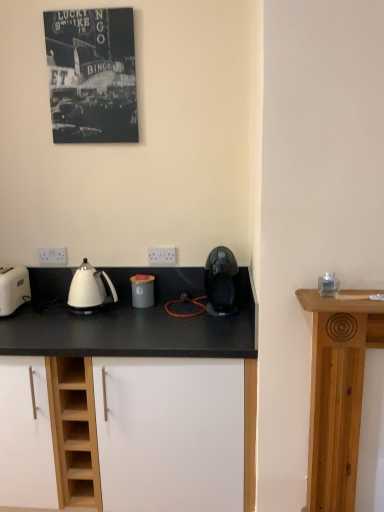
Question: From a real-world perspective, does white plastic electric outlet at lower left, the second electric outlet positioned from the right, stand above white plastic toaster at left?

Choices:
 (A) no
 (B) yes

Answer: (B)

Question: Is white plastic electric outlet at lower left, the second electric outlet positioned from the right, surrounding white plastic toaster at left?

Choices:
 (A) yes
 (B) no

Answer: (B)

Question: From the image's perspective, does white plastic electric outlet at lower left, the first electric outlet positioned from the left, appear lower than white plastic toaster at left?

Choices:
 (A) yes
 (B) no

Answer: (B)

Question: From the image's perspective, is white plastic electric outlet at lower left, the first electric outlet positioned from the left, above white plastic toaster at left?

Choices:
 (A) yes
 (B) no

Answer: (A)

Question: Considering the relative sizes of white plastic electric outlet at lower left, the first electric outlet positioned from the left, and white plastic toaster at left in the image provided, is white plastic electric outlet at lower left, the first electric outlet positioned from the left, bigger than white plastic toaster at left?

Choices:
 (A) yes
 (B) no

Answer: (B)

Question: Can you confirm if white plastic electric outlet at lower left, the second electric outlet positioned from the right, is smaller than white plastic toaster at left?

Choices:
 (A) no
 (B) yes

Answer: (B)

Question: Can you confirm if matte gray canister at center, the 1th kitchen appliance in the left-to-right sequence, is bigger than white plastic electric outlet at center, marked as the 1th electric outlet in a right-to-left arrangement?

Choices:
 (A) yes
 (B) no

Answer: (A)

Question: Does matte gray canister at center, the 1th kitchen appliance in the left-to-right sequence, appear on the right side of white plastic electric outlet at center, the second electric outlet from the back?

Choices:
 (A) yes
 (B) no

Answer: (B)

Question: Is matte gray canister at center, the 1th kitchen appliance in the left-to-right sequence, located outside white plastic electric outlet at center, marked as the 1th electric outlet in a right-to-left arrangement?

Choices:
 (A) no
 (B) yes

Answer: (B)

Question: From the image's perspective, is matte gray canister at center, the 1th kitchen appliance in the left-to-right sequence, on white plastic electric outlet at center, marked as the 1th electric outlet in a right-to-left arrangement?

Choices:
 (A) no
 (B) yes

Answer: (A)

Question: Could you tell me if matte gray canister at center, the 1th kitchen appliance in the left-to-right sequence, is facing white plastic electric outlet at center, marked as the 1th electric outlet in a right-to-left arrangement?

Choices:
 (A) no
 (B) yes

Answer: (A)

Question: Is matte gray canister at center, which is the 2th kitchen appliance from right to left, at the left side of white plastic electric outlet at center, the second electric outlet from the back?

Choices:
 (A) no
 (B) yes

Answer: (B)

Question: Is matte gray canister at center, which is the 2th kitchen appliance from right to left, next to white glossy kettle at left?

Choices:
 (A) no
 (B) yes

Answer: (A)